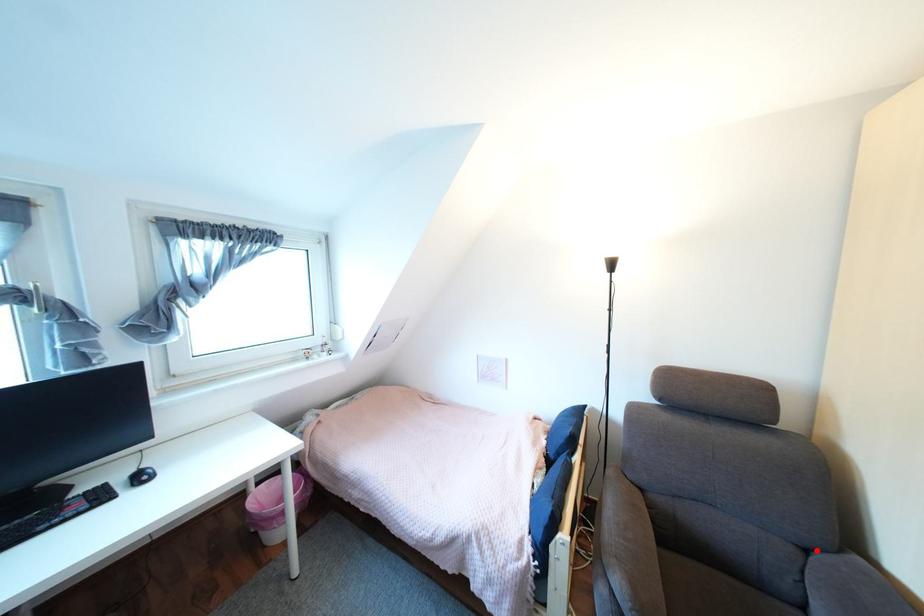
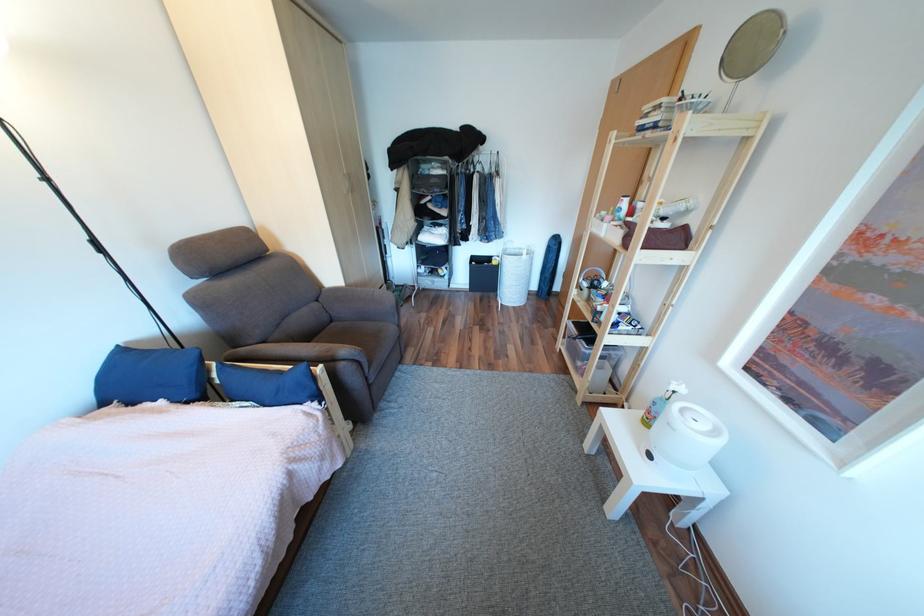
Locate, in the second image, the point that corresponds to the highlighted location in the first image.

(329, 301)